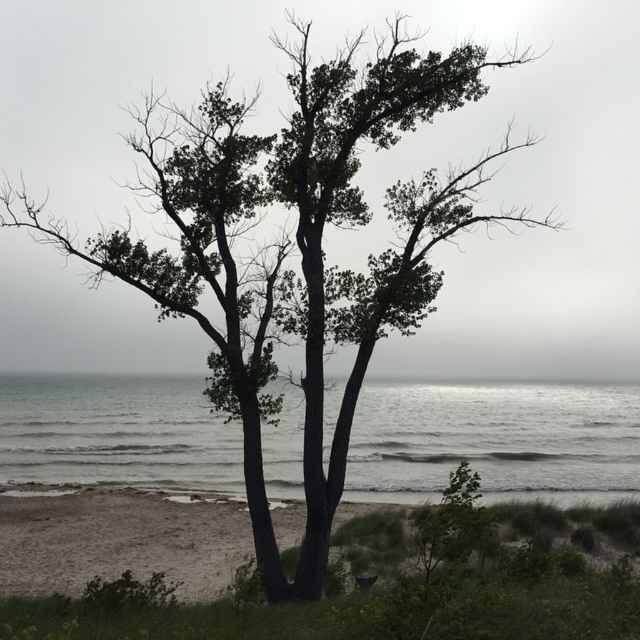
Question: Among these objects, which one is farthest from the camera?

Choices:
 (A) sandy brown sand at lower center
 (B) gray water at center

Answer: (A)

Question: In this image, where is gray water at center located relative to sandy brown sand at lower center?

Choices:
 (A) left
 (B) right

Answer: (B)

Question: Which object is farther from the camera taking this photo?

Choices:
 (A) gray water at center
 (B) sandy brown sand at lower center

Answer: (B)

Question: Is gray water at center above sandy brown sand at lower center?

Choices:
 (A) no
 (B) yes

Answer: (B)

Question: Observing the image, what is the correct spatial positioning of gray water at center in reference to sandy brown sand at lower center?

Choices:
 (A) left
 (B) right

Answer: (B)